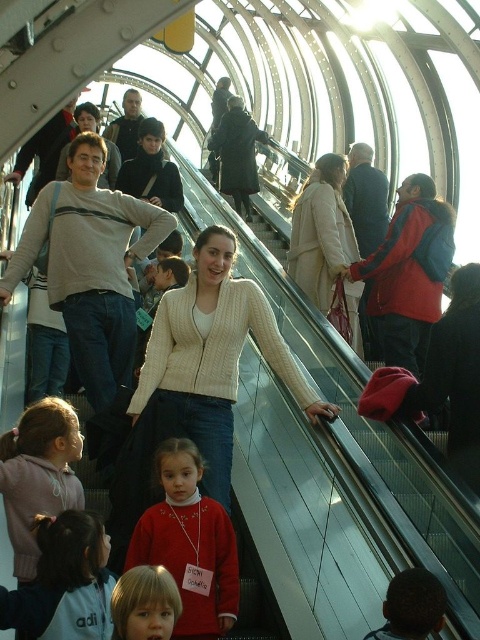
Question: Which of the following is the closest to the observer?

Choices:
 (A) matte red sweater at center
 (B) pink fleece jacket at lower left
 (C) matte red sweater at lower center

Answer: (C)

Question: Does white knitted sweater at center appear on the left side of pink fleece jacket at lower left?

Choices:
 (A) yes
 (B) no

Answer: (B)

Question: Does white knit sweater at center have a larger size compared to matte red sweater at lower center?

Choices:
 (A) yes
 (B) no

Answer: (A)

Question: Which point is closer to the camera?

Choices:
 (A) white knit sweater at center
 (B) white knitted sweater at center

Answer: (B)

Question: Is white knitted sweater at center further to camera compared to matte red sweater at lower center?

Choices:
 (A) yes
 (B) no

Answer: (A)

Question: Which object is the farthest from the white knitted sweater at center?

Choices:
 (A) pink fleece jacket at lower left
 (B) white knit sweater at center
 (C) matte red sweater at center
 (D) matte red sweater at lower center

Answer: (D)